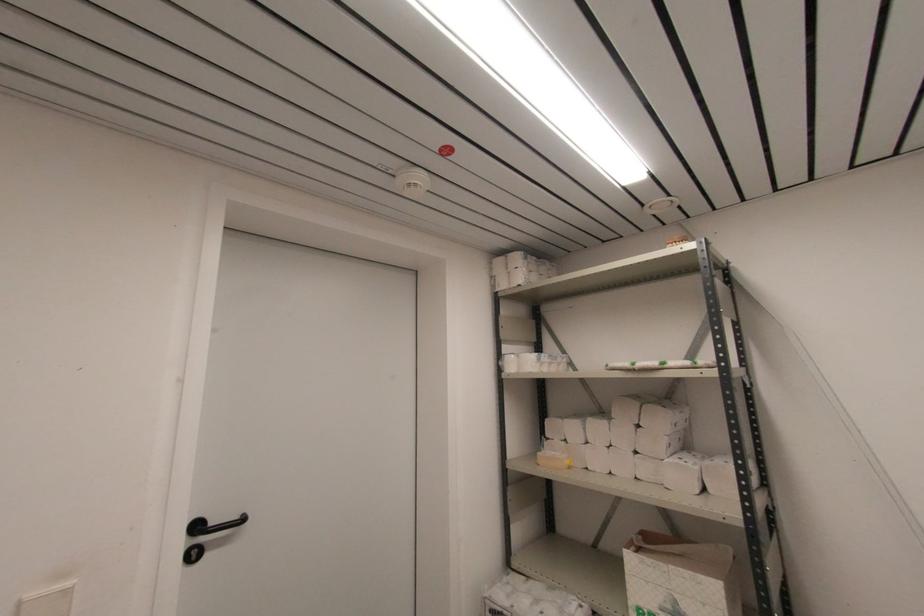
The location [553,460] corresponds to which object?

It corresponds to the small yellow container in the image.